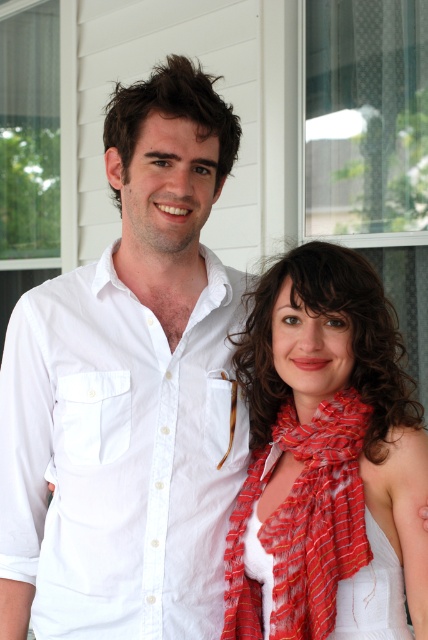
Is white cotton shirt at center to the right of striped silk scarf at center from the viewer's perspective?

In fact, white cotton shirt at center is to the left of striped silk scarf at center.

Is point (155, 602) positioned after point (335, 397)?

No, (155, 602) is in front of (335, 397).

Where is `white cotton shirt at center`? white cotton shirt at center is located at coordinates (119, 456).

Is red striped scarf at center positioned in front of white satin dress at lower right?

That is True.

Which is below, red striped scarf at center or white satin dress at lower right?

Positioned lower is white satin dress at lower right.

Is point (422, 452) behind point (379, 596)?

Yes, it is behind point (379, 596).

Locate an element on the screen. The height and width of the screenshot is (640, 428). red striped scarf at center is located at coordinates (326, 460).

Measure the distance between white cotton shirt at center and camera.

white cotton shirt at center and camera are 4.89 feet apart.

Does white cotton shirt at center have a larger size compared to red striped scarf at center?

A: Indeed, white cotton shirt at center has a larger size compared to red striped scarf at center.

Does point (165, 349) lie behind point (392, 589)?

Yes, point (165, 349) is farther from viewer.

Find the location of a particular element. The image size is (428, 640). white cotton shirt at center is located at coordinates (x=119, y=456).